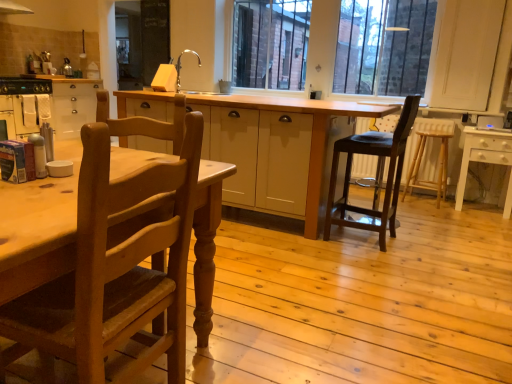
At what (x,y) coordinates should I click in order to perform the action: click on unoccupied region to the right of dark brown wood stool at center-right, the second chair from the left. Please return your answer as a coordinate pair (x, y). The height and width of the screenshot is (384, 512). Looking at the image, I should click on (420, 245).